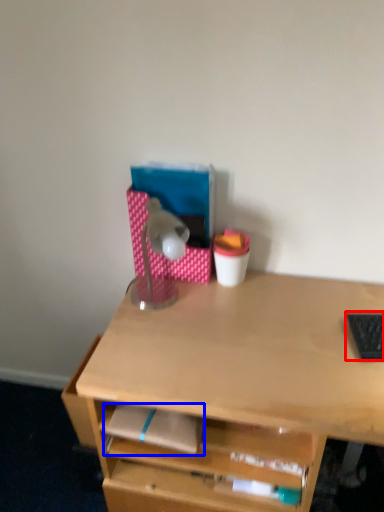
Question: Which of the following is the farthest to the observer, laptop keyboard (highlighted by a red box) or notepad (highlighted by a blue box)?

Choices:
 (A) laptop keyboard
 (B) notepad

Answer: (A)